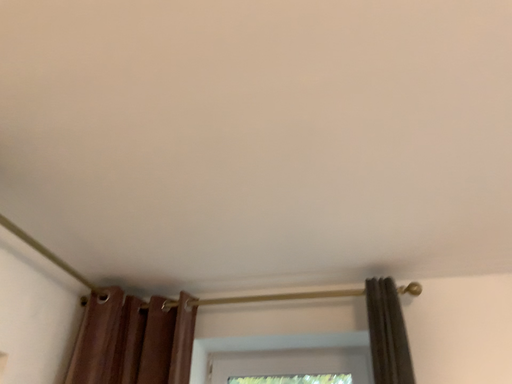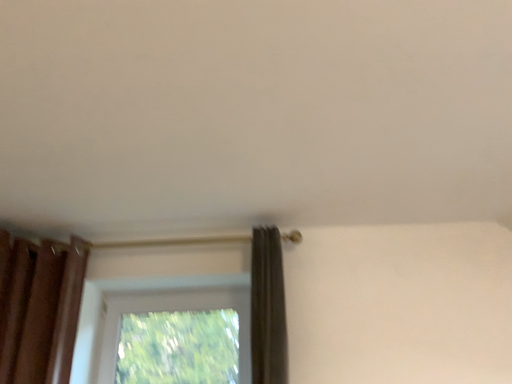
Question: Which way did the camera rotate in the video?

Choices:
 (A) rotated left
 (B) rotated right

Answer: (B)